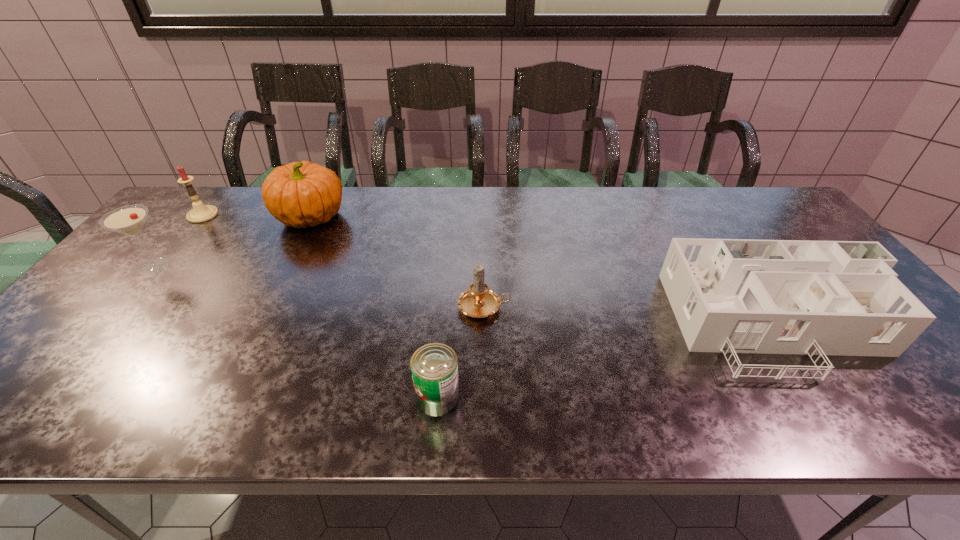
Find the location of a particular element. Image resolution: width=960 pixels, height=540 pixels. vacant space in between the nearer candle and the can is located at coordinates (461, 352).

This screenshot has height=540, width=960. Identify the location of empty space that is in between the third object from left to right and the can. (374, 307).

Find the location of a particular element. The image size is (960, 540). object identified as the closest to the nearer candle is located at coordinates (434, 366).

This screenshot has height=540, width=960. I want to click on the closest object to the right candle, so click(434, 366).

Find the location of a particular element. The width and height of the screenshot is (960, 540). vacant space that satisfies the following two spatial constraints: 1. on the surface of the dollhouse; 2. on the left side of the fourth object from right to left is located at coordinates (259, 323).

Where is `vacant point that satisfies the following two spatial constraints: 1. on the surface of the dollhouse; 2. on the right side of the pumpkin`? vacant point that satisfies the following two spatial constraints: 1. on the surface of the dollhouse; 2. on the right side of the pumpkin is located at coordinates (259, 323).

This screenshot has height=540, width=960. I want to click on blank area in the image that satisfies the following two spatial constraints: 1. on the surface of the pumpkin; 2. on the back side of the dollhouse, so click(259, 323).

Find the location of a particular element. free space that satisfies the following two spatial constraints: 1. on the surface of the third object from left to right; 2. on the right side of the right candle is located at coordinates (267, 307).

Where is `vacant space that satisfies the following two spatial constraints: 1. on the surface of the can; 2. on the left side of the third object from left to right`? Image resolution: width=960 pixels, height=540 pixels. vacant space that satisfies the following two spatial constraints: 1. on the surface of the can; 2. on the left side of the third object from left to right is located at coordinates (222, 397).